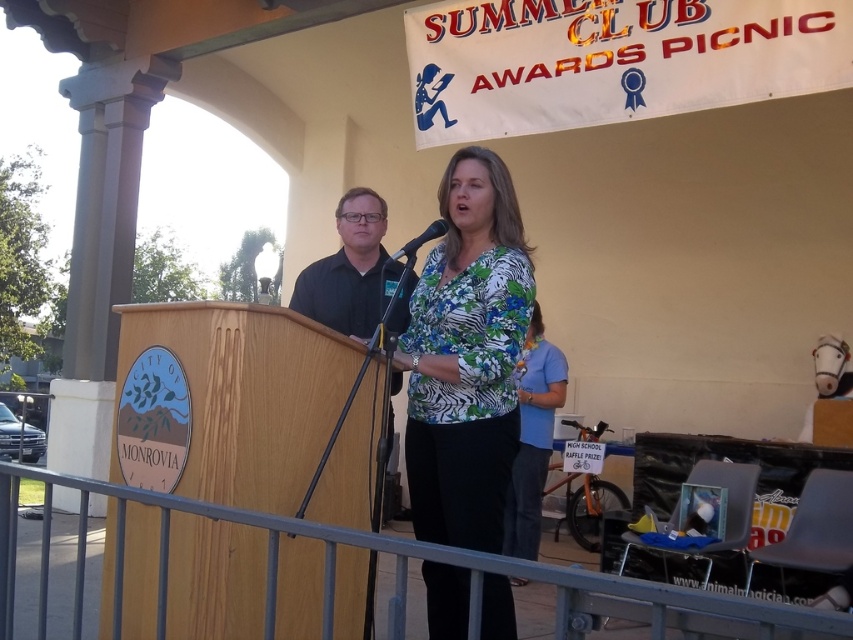
Question: Is the position of blue fabric shirt at center less distant than that of black plastic microphone at center?

Choices:
 (A) no
 (B) yes

Answer: (A)

Question: Is floral print blouse at center to the left of black smooth shirt at center from the viewer's perspective?

Choices:
 (A) no
 (B) yes

Answer: (A)

Question: Which object appears farthest from the camera in this image?

Choices:
 (A) floral print blouse at center
 (B) black plastic microphone at center

Answer: (B)

Question: Considering the real-world distances, which object is farthest from the blue fabric shirt at center?

Choices:
 (A) black smooth shirt at center
 (B) floral print blouse at center
 (C) black plastic microphone at center

Answer: (C)

Question: Which object appears farthest from the camera in this image?

Choices:
 (A) floral print blouse at center
 (B) blue fabric shirt at center
 (C) black smooth shirt at center

Answer: (B)

Question: Is black smooth shirt at center bigger than black plastic microphone at center?

Choices:
 (A) yes
 (B) no

Answer: (A)